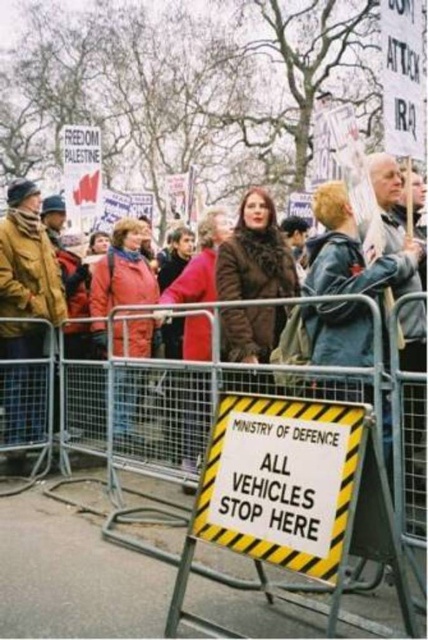
You are a photographer standing at the barricade with the sign. You want to take a photo of the brown leather jacket at left and the metallic silver fence at center. Can you fit both objects in your camera frame if your camera has a maximum field of view of 5 feet?

The brown leather jacket at left and the metallic silver fence at center are 5.11 feet apart, which exceeds the camera frame field of view of 5 feet. Therefore, both objects cannot be captured in a single frame.